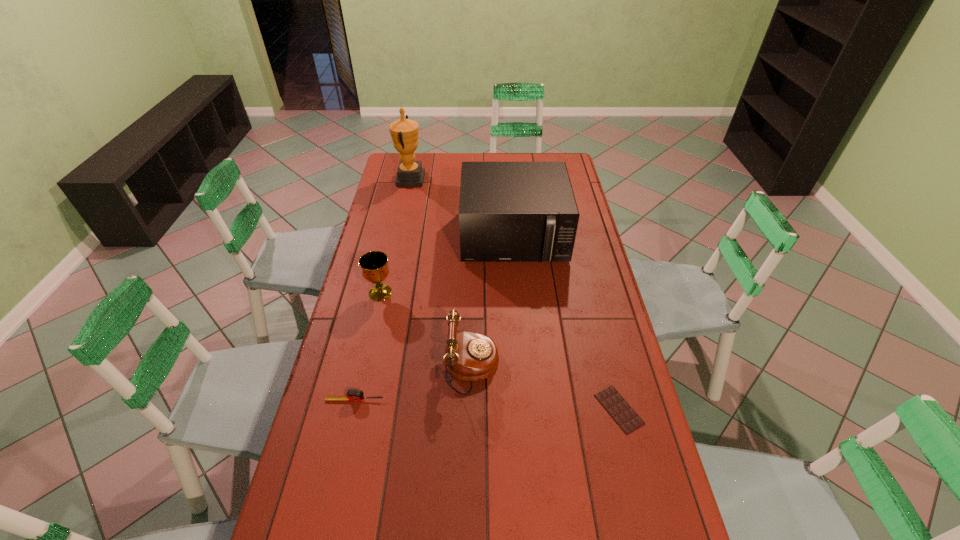
Where is `object that is at the far left corner`? This screenshot has width=960, height=540. object that is at the far left corner is located at coordinates (404, 132).

In the image, there is a desktop. At what (x,y) coordinates should I click in order to perform the action: click on free space at the far edge. Please return your answer as a coordinate pair (x, y). Image resolution: width=960 pixels, height=540 pixels. Looking at the image, I should click on (530, 156).

The width and height of the screenshot is (960, 540). In the image, there is a desktop. Identify the location of vacant space at the left edge. (332, 441).

Locate an element on the screen. The width and height of the screenshot is (960, 540). vacant space at the right edge of the desktop is located at coordinates (629, 396).

Where is `free space at the far right corner`? This screenshot has width=960, height=540. free space at the far right corner is located at coordinates (565, 160).

I want to click on vacant area that lies between the microwave oven and the fourth nearest object, so click(447, 265).

Find the location of a particular element. free space between the second shortest object and the chalice is located at coordinates (368, 347).

This screenshot has height=540, width=960. Identify the location of blank region between the fifth nearest object and the telephone. (492, 302).

Where is `free space between the fourth nearest object and the telephone`? free space between the fourth nearest object and the telephone is located at coordinates (426, 329).

Where is `blank region between the fifth shortest object and the telephone`? This screenshot has height=540, width=960. blank region between the fifth shortest object and the telephone is located at coordinates (492, 302).